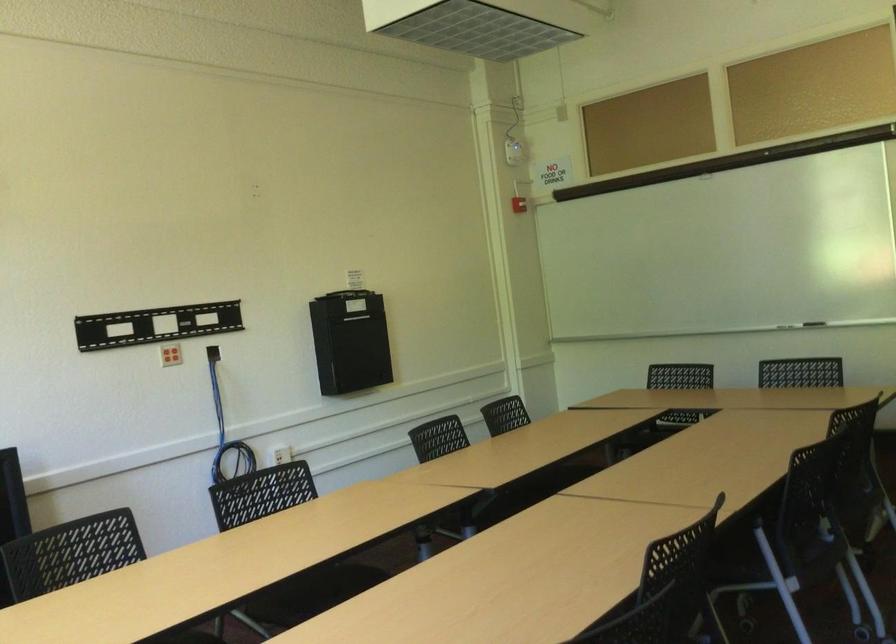
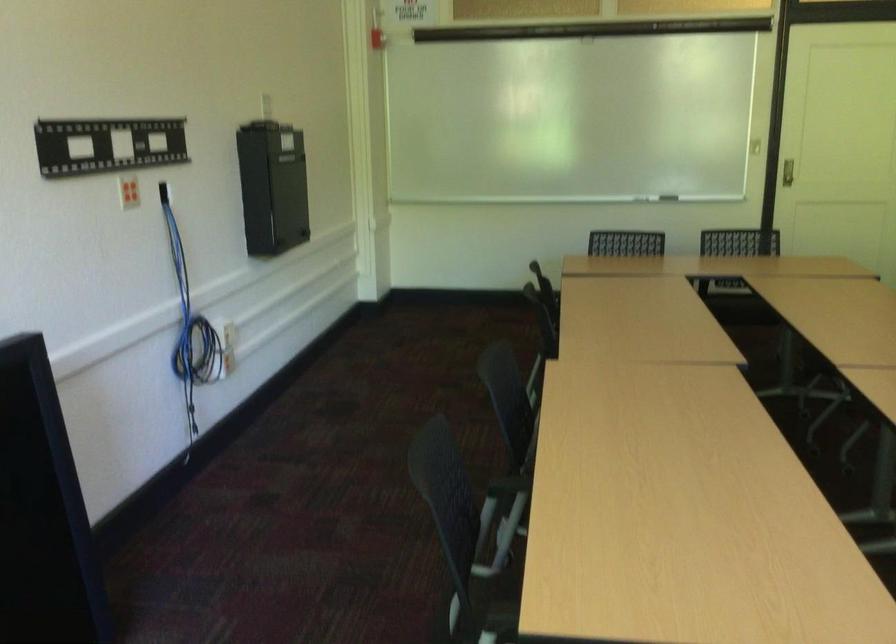
Where in the second image is the point corresponding to the point at 183,573 from the first image?

(506, 486)